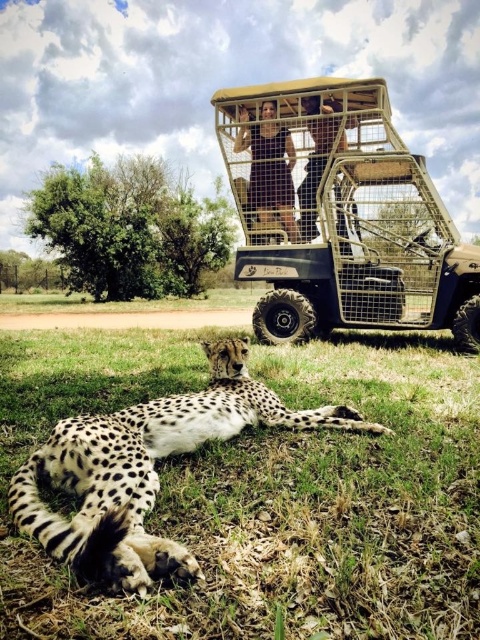
Between spotted fur cheetah at lower left and smooth skin person at center, which one is positioned lower?

spotted fur cheetah at lower left is below.

The width and height of the screenshot is (480, 640). In order to click on spotted fur cheetah at lower left in this screenshot , I will do `click(145, 468)`.

At what (x,y) coordinates should I click in order to perform the action: click on spotted fur cheetah at lower left. Please return your answer as a coordinate pair (x, y). The image size is (480, 640). Looking at the image, I should click on (145, 468).

Which is more to the left, spotted fur cheetah at lower left or dark brown fabric pants at center?

Positioned to the left is spotted fur cheetah at lower left.

I want to click on spotted fur cheetah at lower left, so click(145, 468).

Who is more forward, [264,184] or [308,195]?

Point [308,195] is more forward.

Between dark brown fabric pants at center and smooth skin person at center, which one has more height?

dark brown fabric pants at center is taller.

Is point (284, 160) farther from viewer compared to point (307, 104)?

Yes, it is behind point (307, 104).

The width and height of the screenshot is (480, 640). I want to click on dark brown fabric pants at center, so click(x=269, y=168).